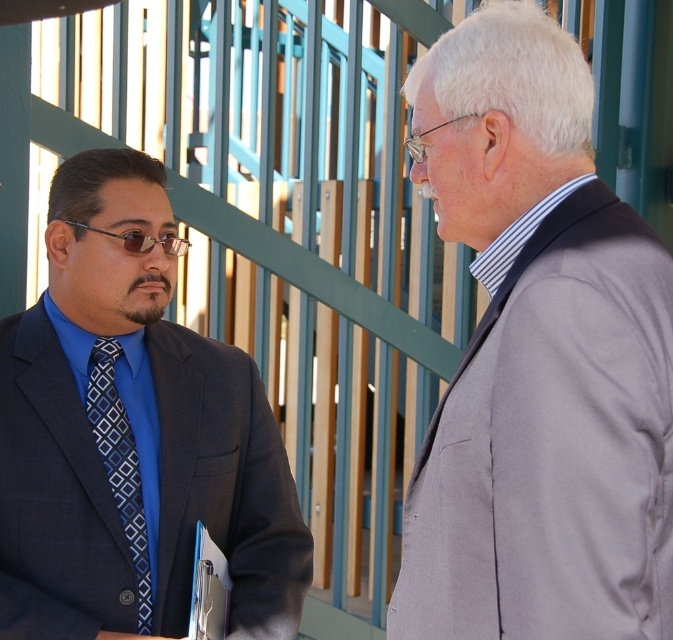
You are a photographer standing 10 feet away from the two men. You want to take a photo of both of them in the same frame. Can you position yourself so that both the gray wool suit at right and the man in the dark suit with blue shirt and patterned tie at left are fully visible in your camera frame?

The two men are 9.31 feet apart. Since you are standing 10 feet away from them, the distance between them is less than the distance from you to them. This means both the gray wool suit at right and the man in the dark suit with blue shirt and patterned tie at left can be captured in the same frame as their separation is within the camera field of view.

You are standing in the same location as the photographer who took the image. If you want to take a closer look at the gray wool suit at right, which direction should you move? Please provide your answer in terms of cardinal directions like north, south, east, west, or combinations like northeast.

Since the gray wool suit at right is located at point coordinates of 0.562 on the x axis and 0.801 on the y axis, you should move east to get closer to it.

Based on the scene description, can you identify the object located at the coordinates point (538, 358)?

The point (538, 358) corresponds to the gray wool suit at right.